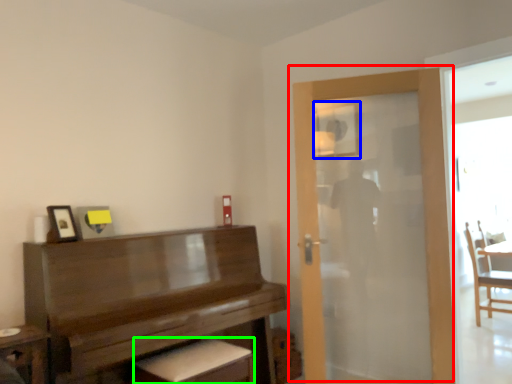
Question: Estimate the real-world distances between objects in this image. Which object is closer to door (highlighted by a red box), mirror (highlighted by a blue box) or footrest (highlighted by a green box)?

Choices:
 (A) mirror
 (B) footrest

Answer: (A)